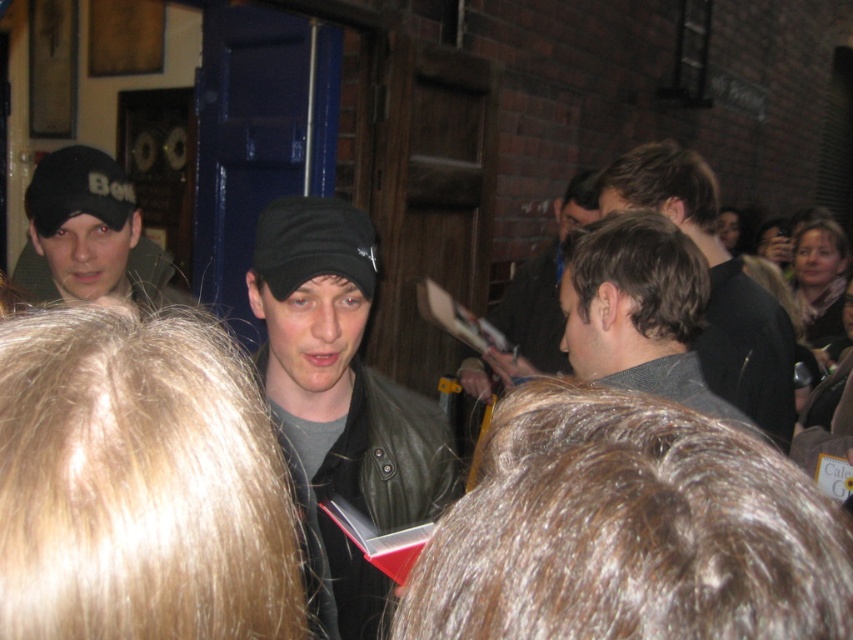
You are a photographer trying to capture a clear shot of the dark gray hair at center and the leather jacket at center. Since you want to focus on the smaller object, which one should you aim your camera at?

The dark gray hair at center has a smaller size compared to the leather jacket at center, so you should aim your camera at the dark gray hair at center to focus on the smaller object.

From the picture: You are a photographer trying to capture a clear shot of the dark gray hair at center and the leather jacket at center from the front row. Considering their sizes, which object would appear wider in the photo?

The leather jacket at center would appear wider in the photo because it has a greater width than the dark gray hair at center according to the description.